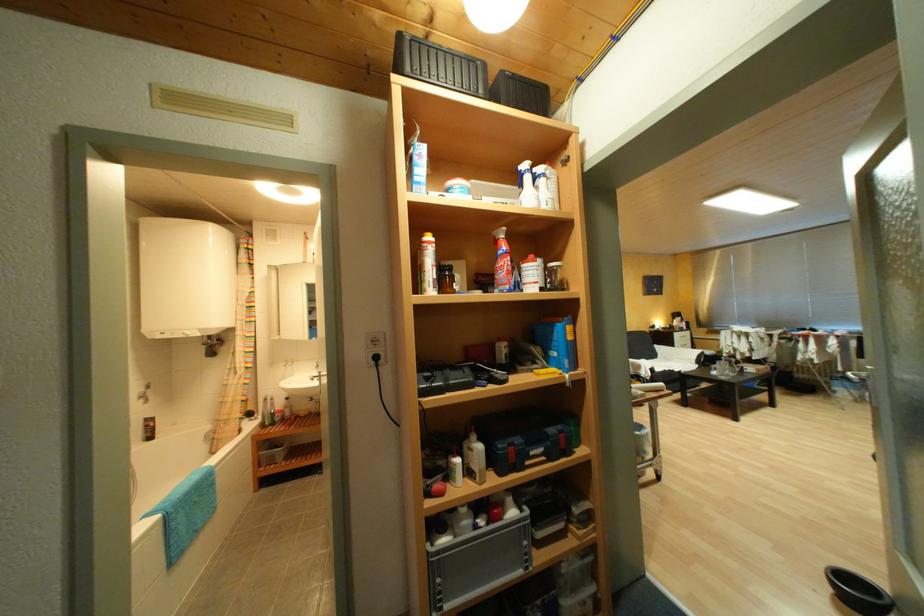
Find the location of `black bowl`. black bowl is located at coordinates (858, 592).